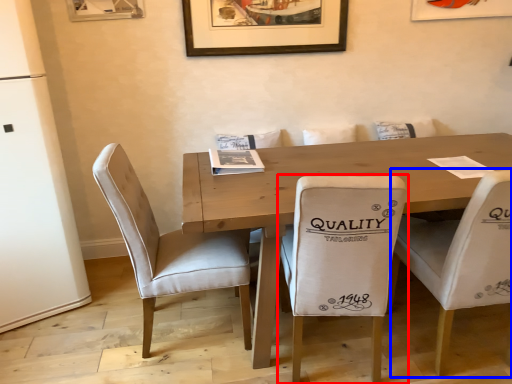
Question: Which point is closer to the camera, chair (highlighted by a red box) or chair (highlighted by a blue box)?

Choices:
 (A) chair
 (B) chair

Answer: (A)